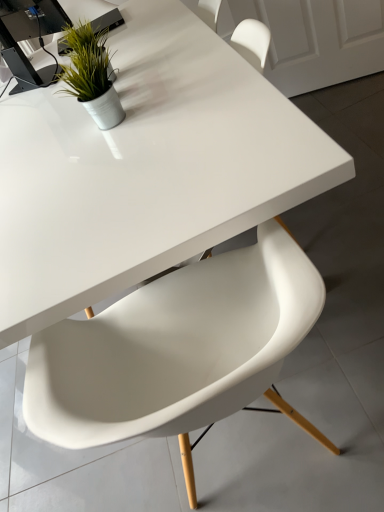
Describe the element at coordinates (146, 169) in the screenshot. I see `white glossy table at center` at that location.

What do you see at coordinates (28, 37) in the screenshot? I see `black plastic computer desk at upper left` at bounding box center [28, 37].

This screenshot has width=384, height=512. What are the coordinates of `green matte plant at upper left` in the screenshot? It's located at (91, 74).

How different are the orientations of green matte plant at upper left and white glossy table at center in degrees?

The facing directions of green matte plant at upper left and white glossy table at center are 0.000328 degrees apart.

Considering the points (111, 124) and (99, 134), which point is in front, point (111, 124) or point (99, 134)?

The point (111, 124) is closer to the camera.

Considering the relative positions of green matte plant at upper left and white glossy table at center in the image provided, is green matte plant at upper left in front of white glossy table at center?

No, green matte plant at upper left is behind white glossy table at center.

Considering the relative sizes of green matte plant at upper left and white glossy table at center in the image provided, is green matte plant at upper left wider than white glossy table at center?

No.

Considering the relative positions of white glossy table at center and white plastic chair at center in the image provided, is white glossy table at center to the right of white plastic chair at center from the viewer's perspective?

Incorrect, white glossy table at center is not on the right side of white plastic chair at center.

Is point (143, 239) more distant than point (149, 418)?

Yes, point (143, 239) is farther from viewer.

Looking at this image, is white glossy table at center situated inside white plastic chair at center or outside?

The correct answer is: outside.

Which of these two, white glossy table at center or white plastic chair at center, is wider?

white glossy table at center.

Measure the distance from green matte plant at upper left to black plastic computer desk at upper left.

The distance of green matte plant at upper left from black plastic computer desk at upper left is 19.23 inches.

Is black plastic computer desk at upper left completely or partially inside green matte plant at upper left?

No, black plastic computer desk at upper left is not a part of green matte plant at upper left.

From the image's perspective, which object appears higher, green matte plant at upper left or black plastic computer desk at upper left?

From the image's view, black plastic computer desk at upper left is above.

Can you tell me how much green matte plant at upper left and black plastic computer desk at upper left differ in facing direction?

There is a 44-degree angle between the facing directions of green matte plant at upper left and black plastic computer desk at upper left.

The image size is (384, 512). In order to click on chair located below the green matte plant at upper left (from the image's perspective) in this screenshot , I will do `click(177, 351)`.

Is point (112, 309) positioned in front of point (89, 46)?

Yes, it is.

Is white plastic chair at center behind green matte plant at upper left?

No, white plastic chair at center is closer to the viewer.

Which of these two, black plastic computer desk at upper left or green matte plant at upper left, stands taller?

Standing taller between the two is black plastic computer desk at upper left.

Is green matte plant at upper left at the back of black plastic computer desk at upper left?

No, green matte plant at upper left is not at the back of black plastic computer desk at upper left.

Can you confirm if black plastic computer desk at upper left is thinner than green matte plant at upper left?

In fact, black plastic computer desk at upper left might be wider than green matte plant at upper left.

Does point (21, 4) lie in front of point (88, 28)?

No.

From a real-world perspective, between black plastic computer desk at upper left and white plastic chair at center, who is vertically lower?

white plastic chair at center.

Consider the image. Considering the relative sizes of black plastic computer desk at upper left and white plastic chair at center in the image provided, is black plastic computer desk at upper left shorter than white plastic chair at center?

Yes.

From the picture: Choose the correct answer: Is black plastic computer desk at upper left inside white plastic chair at center or outside it?

black plastic computer desk at upper left cannot be found inside white plastic chair at center.

Can you confirm if black plastic computer desk at upper left is positioned to the right of white plastic chair at center?

In fact, black plastic computer desk at upper left is to the left of white plastic chair at center.

Is black plastic computer desk at upper left further to camera compared to white glossy table at center?

Yes, it is.

From the image's perspective, which one is positioned higher, black plastic computer desk at upper left or white glossy table at center?

From the image's view, black plastic computer desk at upper left is above.

From the picture: Is black plastic computer desk at upper left taller than white glossy table at center?

No.

How far apart are black plastic computer desk at upper left and white glossy table at center?

The distance of black plastic computer desk at upper left from white glossy table at center is 24.88 inches.

The width and height of the screenshot is (384, 512). I want to click on table lying on the right of green matte plant at upper left, so click(146, 169).

I want to click on table above the white plastic chair at center (from the image's perspective), so click(x=146, y=169).

Considering their positions, is white glossy table at center positioned closer to white plastic chair at center than green matte plant at upper left?

white glossy table at center lies closer to white plastic chair at center than the other object.

In the scene shown: Based on their spatial positions, is green matte plant at upper left or black plastic computer desk at upper left further from white plastic chair at center?

black plastic computer desk at upper left.

From the image, which object appears to be nearer to white plastic chair at center, black plastic computer desk at upper left or green matte plant at upper left?

Based on the image, green matte plant at upper left appears to be nearer to white plastic chair at center.

Considering their positions, is white glossy table at center positioned further to black plastic computer desk at upper left than white plastic chair at center?

white plastic chair at center.

When comparing their distances from white glossy table at center, does black plastic computer desk at upper left or white plastic chair at center seem further?

Based on the image, black plastic computer desk at upper left appears to be further to white glossy table at center.

When comparing their distances from green matte plant at upper left, does white glossy table at center or black plastic computer desk at upper left seem closer?

white glossy table at center is positioned closer to the anchor green matte plant at upper left.

Considering their positions, is white glossy table at center positioned further to green matte plant at upper left than white plastic chair at center?

Among the two, white plastic chair at center is located further to green matte plant at upper left.

From the image, which object appears to be nearer to green matte plant at upper left, black plastic computer desk at upper left or white glossy table at center?

white glossy table at center is closer to green matte plant at upper left.

Locate an element on the screen. This screenshot has width=384, height=512. houseplant between black plastic computer desk at upper left and white plastic chair at center from top to bottom is located at coordinates (91, 74).

Where is `houseplant between white glossy table at center and black plastic computer desk at upper left along the z-axis`? This screenshot has height=512, width=384. houseplant between white glossy table at center and black plastic computer desk at upper left along the z-axis is located at coordinates (91, 74).

Find the location of a particular element. This screenshot has width=384, height=512. table between black plastic computer desk at upper left and white plastic chair at center vertically is located at coordinates (146, 169).

Where is `table between green matte plant at upper left and white plastic chair at center in the up-down direction`? The height and width of the screenshot is (512, 384). table between green matte plant at upper left and white plastic chair at center in the up-down direction is located at coordinates (146, 169).